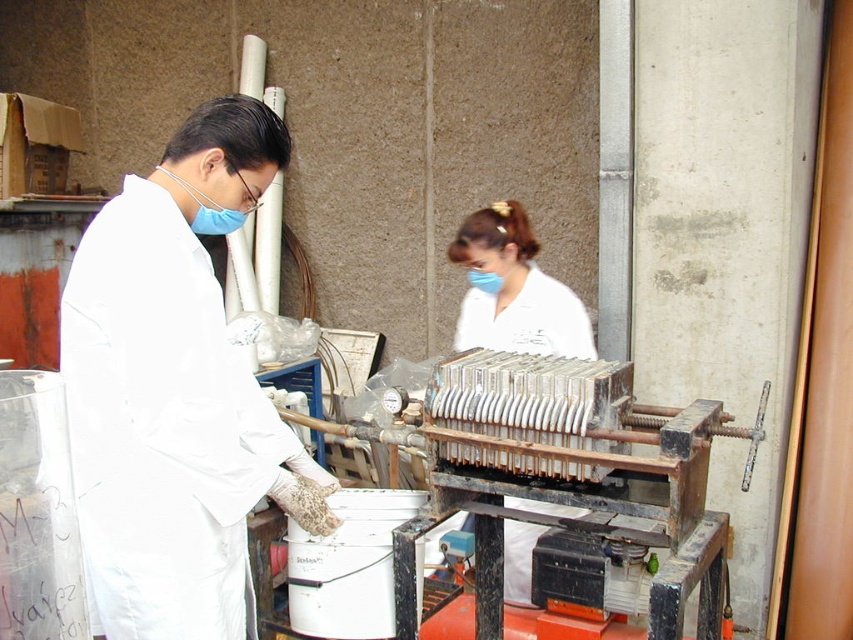
Question: Does rusty metal press at center appear over white matte uniform at center?

Choices:
 (A) yes
 (B) no

Answer: (B)

Question: Which object is the closest to the white matte uniform at center?

Choices:
 (A) rusty metal press at center
 (B) white matte lab coat at left

Answer: (A)

Question: Estimate the real-world distances between objects in this image. Which object is closer to the white matte uniform at center?

Choices:
 (A) white matte lab coat at left
 (B) rusty metal press at center

Answer: (B)

Question: Is rusty metal press at center further to the viewer compared to white matte uniform at center?

Choices:
 (A) yes
 (B) no

Answer: (B)

Question: Among these objects, which one is nearest to the camera?

Choices:
 (A) rusty metal press at center
 (B) white matte lab coat at left
 (C) white matte uniform at center

Answer: (B)

Question: Does rusty metal press at center have a lesser width compared to white matte uniform at center?

Choices:
 (A) yes
 (B) no

Answer: (B)